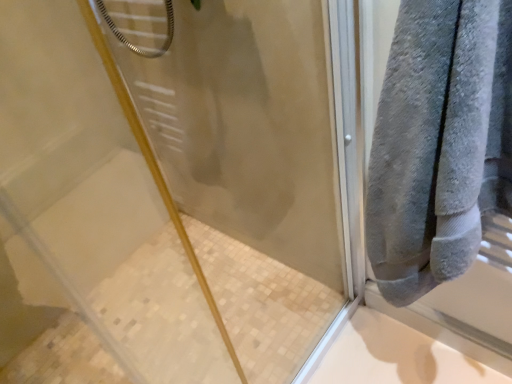
Locate an element on the screen. transparent glass shower door at upper right is located at coordinates (180, 179).

Describe the element at coordinates (180, 179) in the screenshot. I see `transparent glass shower door at upper right` at that location.

This screenshot has width=512, height=384. What do you see at coordinates (439, 143) in the screenshot?
I see `gray soft towel at right` at bounding box center [439, 143].

Identify the location of gray soft towel at right. (439, 143).

This screenshot has height=384, width=512. Find the location of `transparent glass shower door at upper right`. transparent glass shower door at upper right is located at coordinates (180, 179).

Which object is positioned more to the right, gray soft towel at right or transparent glass shower door at upper right?

From the viewer's perspective, gray soft towel at right appears more on the right side.

Is the position of gray soft towel at right more distant than that of transparent glass shower door at upper right?

Yes, it is behind transparent glass shower door at upper right.

Considering the points (420, 86) and (224, 140), which point is behind, point (420, 86) or point (224, 140)?

The point (224, 140) is behind.

From the image's perspective, which object appears higher, gray soft towel at right or transparent glass shower door at upper right?

gray soft towel at right is shown above in the image.

From a real-world perspective, relative to transparent glass shower door at upper right, is gray soft towel at right vertically above or below?

In terms of real-world spatial position, gray soft towel at right is above transparent glass shower door at upper right.

Does gray soft towel at right have a lesser width compared to transparent glass shower door at upper right?

No.

Does gray soft towel at right have a lesser height compared to transparent glass shower door at upper right?

Yes.

Does gray soft towel at right have a larger size compared to transparent glass shower door at upper right?

No.

Is transparent glass shower door at upper right located within gray soft towel at right?

No.

Is gray soft towel at right positioned far away from transparent glass shower door at upper right?

gray soft towel at right is actually quite close to transparent glass shower door at upper right.

Is gray soft towel at right aimed at transparent glass shower door at upper right?

No, gray soft towel at right does not turn towards transparent glass shower door at upper right.

In the scene shown: How far apart are gray soft towel at right and transparent glass shower door at upper right?

The distance of gray soft towel at right from transparent glass shower door at upper right is 51.71 centimeters.

Locate an element on the screen. The height and width of the screenshot is (384, 512). screen door below the gray soft towel at right (from a real-world perspective) is located at coordinates (180, 179).

Visually, is transparent glass shower door at upper right positioned to the left or to the right of gray soft towel at right?

In the image, transparent glass shower door at upper right appears on the left side of gray soft towel at right.

Does transparent glass shower door at upper right lie in front of gray soft towel at right?

Yes, transparent glass shower door at upper right is in front of gray soft towel at right.

Which point is more forward, (x=338, y=47) or (x=413, y=164)?

The point (x=413, y=164) is more forward.

From the image's perspective, which is above, transparent glass shower door at upper right or gray soft towel at right?

gray soft towel at right, from the image's perspective.

From a real-world perspective, does transparent glass shower door at upper right stand above gray soft towel at right?

No, from a real-world perspective, transparent glass shower door at upper right is not above gray soft towel at right.

From the picture: Considering the relative sizes of transparent glass shower door at upper right and gray soft towel at right in the image provided, is transparent glass shower door at upper right thinner than gray soft towel at right?

Indeed, transparent glass shower door at upper right has a lesser width compared to gray soft towel at right.

Which of these two, transparent glass shower door at upper right or gray soft towel at right, stands taller?

With more height is transparent glass shower door at upper right.

Can you confirm if transparent glass shower door at upper right is bigger than gray soft towel at right?

Yes.

Is transparent glass shower door at upper right not within gray soft towel at right?

Indeed, transparent glass shower door at upper right is completely outside gray soft towel at right.

Is transparent glass shower door at upper right far from gray soft towel at right?

No.

Is transparent glass shower door at upper right oriented towards gray soft towel at right?

Yes, transparent glass shower door at upper right is aimed at gray soft towel at right.

Where is `towel above the transparent glass shower door at upper right (from the image's perspective)`? The width and height of the screenshot is (512, 384). towel above the transparent glass shower door at upper right (from the image's perspective) is located at coordinates (439, 143).

Image resolution: width=512 pixels, height=384 pixels. Find the location of `screen door below the gray soft towel at right (from a real-world perspective)`. screen door below the gray soft towel at right (from a real-world perspective) is located at coordinates (180, 179).

Identify the location of towel above the transparent glass shower door at upper right (from a real-world perspective). This screenshot has height=384, width=512. (439, 143).